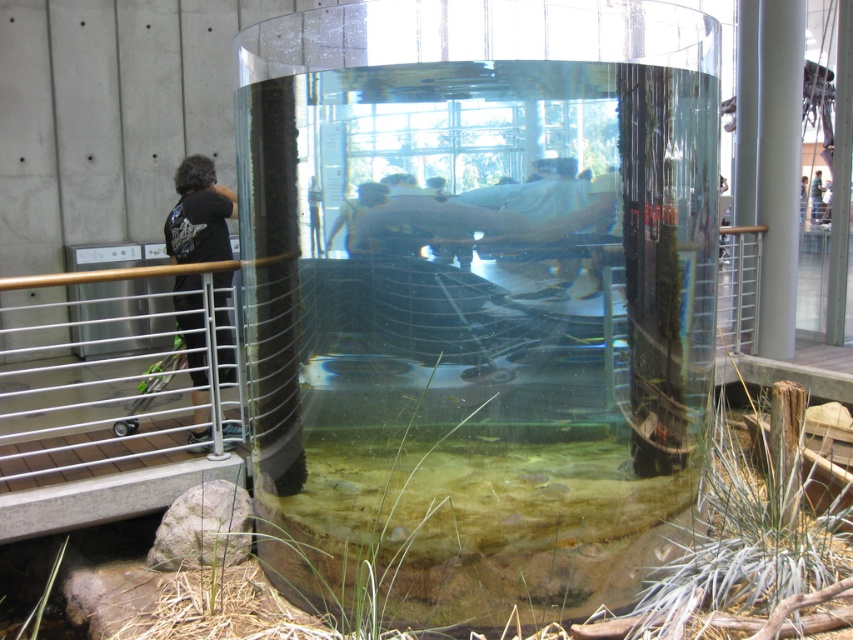
Is point (183, 227) closer to viewer compared to point (820, 211)?

Yes.

Which of these two, black fabric shirt at left or light blue shirt at upper center, stands taller?

black fabric shirt at left is taller.

Is point (202, 227) in front of point (810, 214)?

Yes, point (202, 227) is in front of point (810, 214).

This screenshot has height=640, width=853. What are the coordinates of `black fabric shirt at left` in the screenshot? It's located at (198, 214).

Which is more to the left, clear glass water tank at center or light blue shirt at upper center?

Positioned to the left is clear glass water tank at center.

Is clear glass water tank at center bigger than light blue shirt at upper center?

Indeed, clear glass water tank at center has a larger size compared to light blue shirt at upper center.

Is point (453, 488) closer to camera compared to point (821, 200)?

That is True.

Find the location of `clear glass water tank at center`. clear glass water tank at center is located at coordinates (477, 300).

Is point (247, 60) positioned in front of point (316, 250)?

No.

Between clear glass water tank at center and matte black shirt at center, which one appears on the left side from the viewer's perspective?

From the viewer's perspective, matte black shirt at center appears more on the left side.

Which is in front, point (314, 163) or point (310, 218)?

Point (314, 163) is more forward.

Where is `clear glass water tank at center`? clear glass water tank at center is located at coordinates (477, 300).